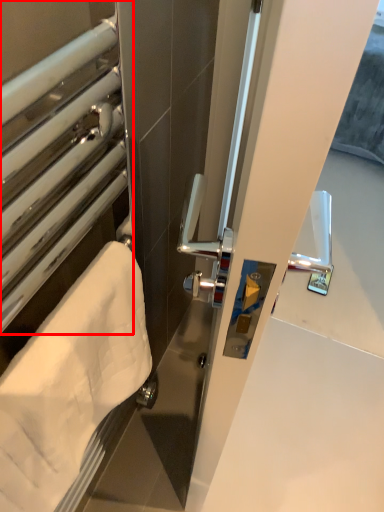
Question: From the image's perspective, considering the relative positions of window (annotated by the red box) and towel in the image provided, where is window (annotated by the red box) located with respect to the staircase?

Choices:
 (A) above
 (B) below

Answer: (A)